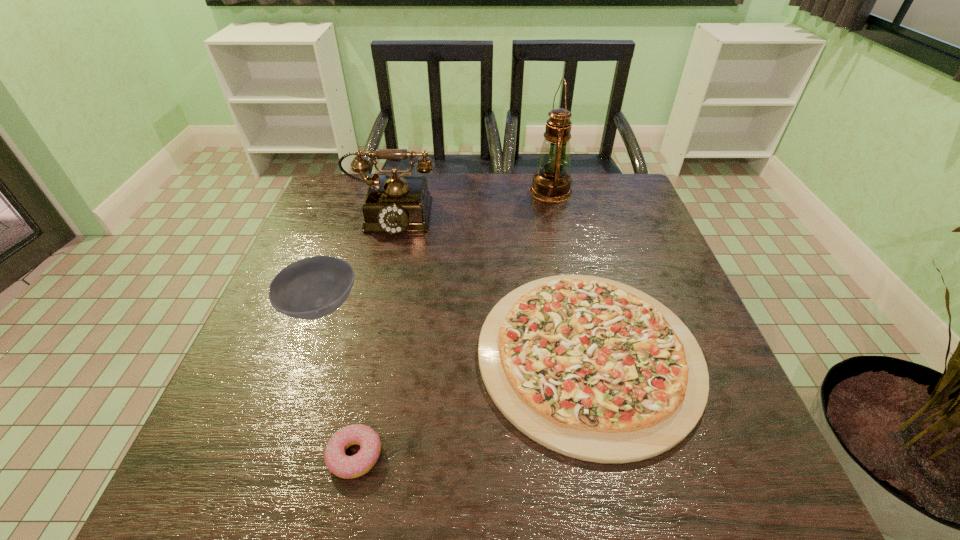
Image resolution: width=960 pixels, height=540 pixels. I want to click on free space between the pizza and the bowl, so click(454, 331).

Identify the location of vacant area that lies between the pizza and the oil lamp. This screenshot has height=540, width=960. tap(569, 273).

Where is `vacant region between the oil lamp and the telephone`? The height and width of the screenshot is (540, 960). vacant region between the oil lamp and the telephone is located at coordinates coord(471,201).

Where is `free spot between the doughnut and the pizza`? This screenshot has width=960, height=540. free spot between the doughnut and the pizza is located at coordinates (472, 405).

Where is `vacant area that lies between the doughnut and the second tallest object`? vacant area that lies between the doughnut and the second tallest object is located at coordinates (373, 334).

The image size is (960, 540). Identify the location of vacant region between the oil lamp and the doughnut. (453, 323).

The width and height of the screenshot is (960, 540). I want to click on object that is the fourth closest to the pizza, so click(x=551, y=183).

In order to click on object that ranks as the closest to the doughnut in this screenshot , I will do `click(591, 368)`.

This screenshot has width=960, height=540. What are the coordinates of `free space that satisfies the following two spatial constraints: 1. on the back side of the third shortest object; 2. on the right side of the oil lamp` in the screenshot? It's located at (362, 191).

You are a GUI agent. You are given a task and a screenshot of the screen. Output one action in this format:
    pyautogui.click(x=<x>, y=<y>)
    Task: Click on the free spot that satisfies the following two spatial constraints: 1. on the dial of the doughnut; 2. on the right side of the fourth shortest object
    The width and height of the screenshot is (960, 540).
    Given the screenshot: What is the action you would take?
    pyautogui.click(x=331, y=456)